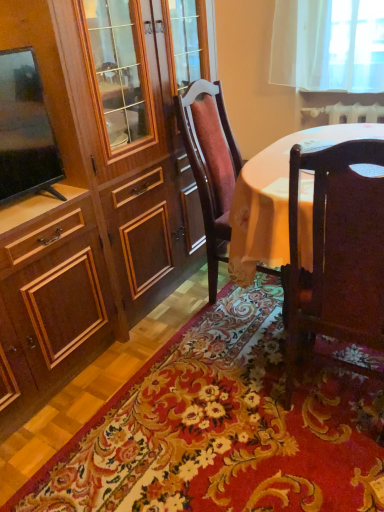
Question: From a real-world perspective, is wooden chair at center, placed as the 1th chair when sorted from back to front, positioned over floral carpet at center based on gravity?

Choices:
 (A) yes
 (B) no

Answer: (A)

Question: Can you confirm if wooden chair at center, which ranks as the 2th chair in front-to-back order, is positioned to the right of floral carpet at center?

Choices:
 (A) no
 (B) yes

Answer: (B)

Question: Is wooden chair at center, placed as the 1th chair when sorted from back to front, shorter than floral carpet at center?

Choices:
 (A) no
 (B) yes

Answer: (A)

Question: Is floral carpet at center a part of wooden chair at center, which ranks as the 2th chair in front-to-back order?

Choices:
 (A) no
 (B) yes

Answer: (A)

Question: Is wooden chair at center, placed as the 1th chair when sorted from back to front, far from floral carpet at center?

Choices:
 (A) no
 (B) yes

Answer: (A)

Question: Is the position of wooden chair at center, placed as the 1th chair when sorted from back to front, less distant than that of floral carpet at center?

Choices:
 (A) no
 (B) yes

Answer: (A)

Question: Can we say floral carpet at center lies outside dark wood chair at lower right, the first chair from the front?

Choices:
 (A) yes
 (B) no

Answer: (A)

Question: Is the depth of floral carpet at center greater than that of dark wood chair at lower right, arranged as the 2th chair when viewed from the back?

Choices:
 (A) yes
 (B) no

Answer: (A)

Question: Is floral carpet at center at the left side of dark wood chair at lower right, arranged as the 2th chair when viewed from the back?

Choices:
 (A) no
 (B) yes

Answer: (B)

Question: From a real-world perspective, is floral carpet at center under dark wood chair at lower right, the first chair from the front?

Choices:
 (A) yes
 (B) no

Answer: (A)

Question: Is floral carpet at center taller than dark wood chair at lower right, arranged as the 2th chair when viewed from the back?

Choices:
 (A) yes
 (B) no

Answer: (B)

Question: Is floral carpet at center with dark wood chair at lower right, the first chair from the front?

Choices:
 (A) no
 (B) yes

Answer: (A)

Question: Considering the relative sizes of wooden chair at center, placed as the 1th chair when sorted from back to front, and dark wood chair at lower right, arranged as the 2th chair when viewed from the back, in the image provided, is wooden chair at center, placed as the 1th chair when sorted from back to front, taller than dark wood chair at lower right, arranged as the 2th chair when viewed from the back,?

Choices:
 (A) no
 (B) yes

Answer: (B)